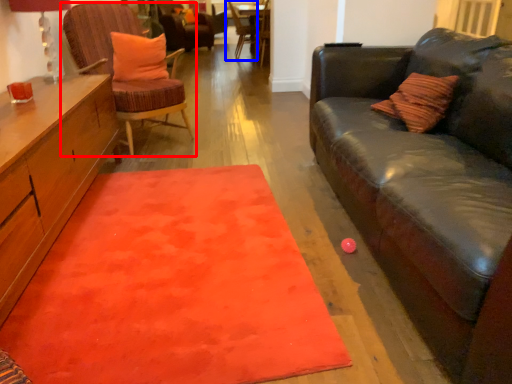
Question: Which of the following is the closest to the observer, chair (highlighted by a red box) or chair (highlighted by a blue box)?

Choices:
 (A) chair
 (B) chair

Answer: (A)